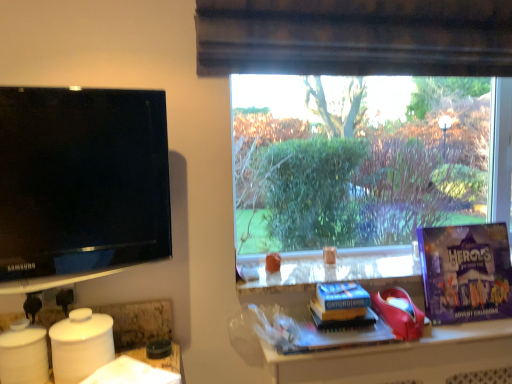
Question: Is hardcover book at center, acting as the second book starting from the top, not within purple cardboard advent calendar at right, which is counted as the first paperback book, starting from the top?

Choices:
 (A) no
 (B) yes

Answer: (B)

Question: Does hardcover book at center, marked as the first book in a bottom-to-top arrangement, turn towards purple cardboard advent calendar at right, which is counted as the first paperback book, starting from the top?

Choices:
 (A) no
 (B) yes

Answer: (A)

Question: Is hardcover book at center, acting as the second book starting from the top, to the left of purple cardboard advent calendar at right, which is the second paperback book from left to right, from the viewer's perspective?

Choices:
 (A) yes
 (B) no

Answer: (A)

Question: Does hardcover book at center, marked as the first book in a bottom-to-top arrangement, appear on the right side of purple cardboard advent calendar at right, which is counted as the first paperback book, starting from the top?

Choices:
 (A) no
 (B) yes

Answer: (A)

Question: Is hardcover book at center, acting as the second book starting from the top, oriented away from purple cardboard advent calendar at right, which is the second paperback book from left to right?

Choices:
 (A) yes
 (B) no

Answer: (B)

Question: Does hardcover book at center, acting as the second book starting from the top, have a smaller size compared to purple cardboard advent calendar at right, marked as the second paperback book in a bottom-to-top arrangement?

Choices:
 (A) yes
 (B) no

Answer: (A)

Question: Considering the relative positions of blue paper at center, which is the 1th paperback book from bottom to top, and matte black tv at left in the image provided, is blue paper at center, which is the 1th paperback book from bottom to top, in front of matte black tv at left?

Choices:
 (A) yes
 (B) no

Answer: (B)

Question: Is blue paper at center, which ranks as the 2th paperback book in top-to-bottom order, far from matte black tv at left?

Choices:
 (A) no
 (B) yes

Answer: (A)

Question: Is blue paper at center, which ranks as the 2th paperback book in top-to-bottom order, taller than matte black tv at left?

Choices:
 (A) yes
 (B) no

Answer: (B)

Question: Is blue paper at center, which is the 1th paperback book from bottom to top, to the right of matte black tv at left from the viewer's perspective?

Choices:
 (A) yes
 (B) no

Answer: (A)

Question: Is blue paper at center, which ranks as the 2th paperback book in top-to-bottom order, facing away from matte black tv at left?

Choices:
 (A) yes
 (B) no

Answer: (B)

Question: From the image's perspective, is blue paper at center, which ranks as the 2th paperback book in top-to-bottom order, beneath matte black tv at left?

Choices:
 (A) yes
 (B) no

Answer: (A)

Question: Can blue paper at center, which ranks as the 2th paperback book in top-to-bottom order, be found inside hardcover book at center, marked as the first book in a bottom-to-top arrangement?

Choices:
 (A) no
 (B) yes

Answer: (A)